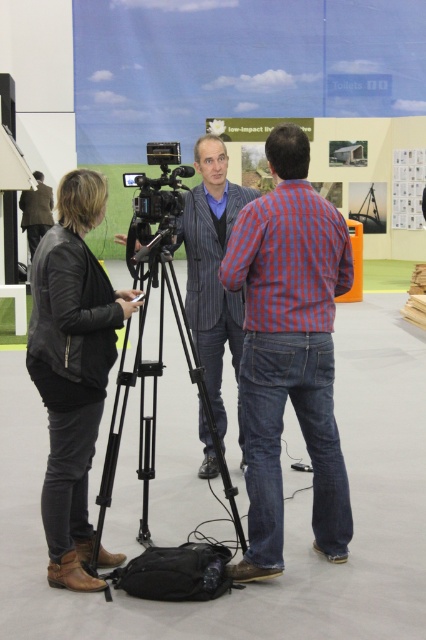
Does matte blue projection screen at upper center have a greater height compared to black leather jacket at left?

Yes.

Is matte blue projection screen at upper center positioned in front of black leather jacket at left?

No, it is not.

This screenshot has width=426, height=640. I want to click on matte blue projection screen at upper center, so click(x=236, y=65).

Locate an element on the screen. This screenshot has width=426, height=640. matte blue projection screen at upper center is located at coordinates (236, 65).

From the picture: Is red checkered shirt at center taller than striped fabric jacket at center?

No, red checkered shirt at center is not taller than striped fabric jacket at center.

Does point (259, 400) come behind point (190, 241)?

No, it is in front of (190, 241).

Does point (322, 376) lie behind point (206, 166)?

No.

Where is `red checkered shirt at center`? The image size is (426, 640). red checkered shirt at center is located at coordinates (288, 349).

Who is shorter, black plastic video camera at center or brown leather jacket at center?

black plastic video camera at center is shorter.

Who is more forward, (163, 180) or (51, 196)?

Point (163, 180) is in front.

Between point (138, 216) and point (28, 193), which one is positioned behind?

Point (28, 193)

Image resolution: width=426 pixels, height=640 pixels. I want to click on black plastic video camera at center, so click(160, 184).